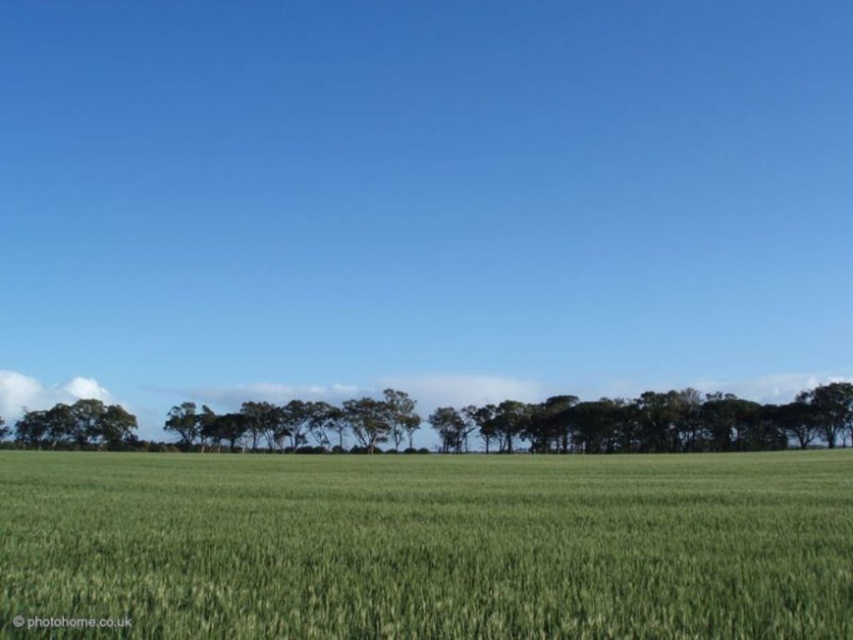
Who is taller, green grassy wheat field at center or green leafy tree at center?

Standing taller between the two is green grassy wheat field at center.

The image size is (853, 640). What do you see at coordinates (428, 547) in the screenshot?
I see `green grassy wheat field at center` at bounding box center [428, 547].

Where is `green grassy wheat field at center`? green grassy wheat field at center is located at coordinates (428, 547).

Where is `green grassy wheat field at center`? The image size is (853, 640). green grassy wheat field at center is located at coordinates (428, 547).